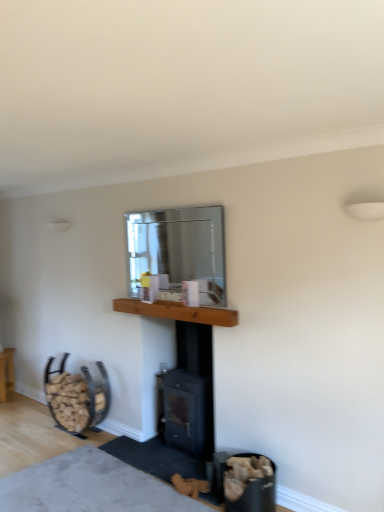
Where is `vacant area on top of soft gray carpet at lower center (from a real-world perspective)`? This screenshot has width=384, height=512. vacant area on top of soft gray carpet at lower center (from a real-world perspective) is located at coordinates (80, 480).